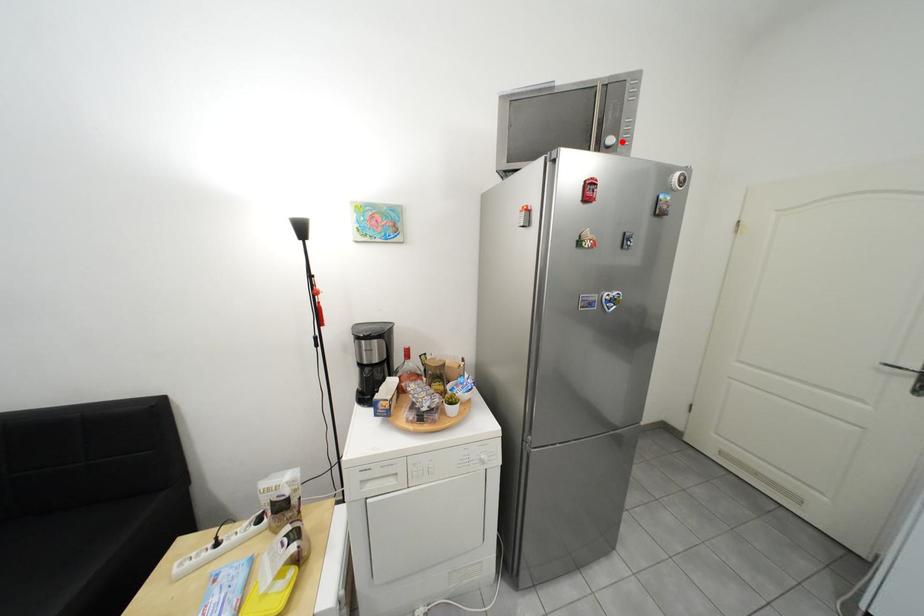
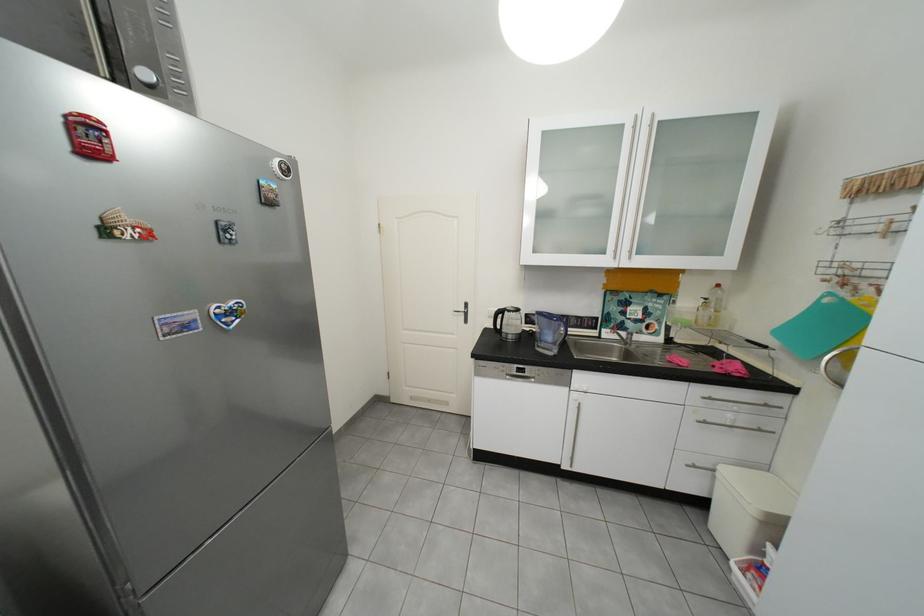
In the second image, find the point that corresponds to the highlighted location in the first image.

(156, 75)